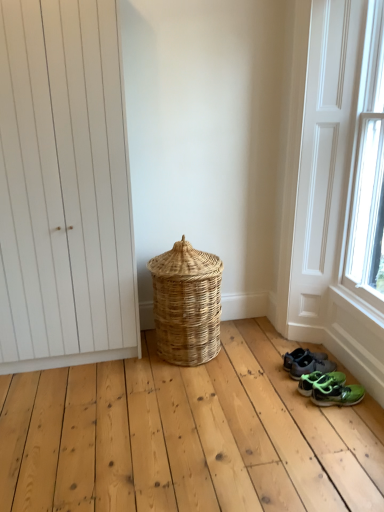
Question: From a real-world perspective, is green matte sneakers at lower right, marked as the third footwear in a back-to-front arrangement, below white wood screen door at lower right?

Choices:
 (A) no
 (B) yes

Answer: (B)

Question: From a real-world perspective, is green matte sneakers at lower right, marked as the third footwear in a back-to-front arrangement, on top of white wood screen door at lower right?

Choices:
 (A) no
 (B) yes

Answer: (A)

Question: Can you confirm if green matte sneakers at lower right, marked as the third footwear in a back-to-front arrangement, is thinner than white wood screen door at lower right?

Choices:
 (A) yes
 (B) no

Answer: (B)

Question: From the image's perspective, is green matte sneakers at lower right, which appears as the 1th footwear when viewed from the front, below white wood screen door at lower right?

Choices:
 (A) yes
 (B) no

Answer: (A)

Question: Does green matte sneakers at lower right, marked as the third footwear in a back-to-front arrangement, come in front of white wood screen door at lower right?

Choices:
 (A) no
 (B) yes

Answer: (A)

Question: From a real-world perspective, is green fabric sneakers at lower right, which ranks as the 1th footwear in back-to-front order, above or below white wood screen door at lower right?

Choices:
 (A) above
 (B) below

Answer: (B)

Question: Visually, is green fabric sneakers at lower right, placed as the third footwear when sorted from front to back, positioned to the left or to the right of white wood screen door at lower right?

Choices:
 (A) left
 (B) right

Answer: (A)

Question: Is green fabric sneakers at lower right, which ranks as the 1th footwear in back-to-front order, wider or thinner than white wood screen door at lower right?

Choices:
 (A) thin
 (B) wide

Answer: (B)

Question: In the image, is green fabric sneakers at lower right, placed as the third footwear when sorted from front to back, positioned in front of or behind white wood screen door at lower right?

Choices:
 (A) front
 (B) behind

Answer: (B)

Question: Relative to green matte sneakers at lower right, which appears as the 1th footwear when viewed from the front, is green rubber sandals at lower right, the second footwear from the front, in front or behind?

Choices:
 (A) front
 (B) behind

Answer: (B)

Question: Is point (312, 356) closer or farther from the camera than point (329, 387)?

Choices:
 (A) closer
 (B) farther

Answer: (B)

Question: From a real-world perspective, relative to green matte sneakers at lower right, which appears as the 1th footwear when viewed from the front, is green rubber sandals at lower right, arranged as the 2th footwear when viewed from the back, vertically above or below?

Choices:
 (A) below
 (B) above

Answer: (A)

Question: Is green rubber sandals at lower right, arranged as the 2th footwear when viewed from the back, to the left or to the right of green matte sneakers at lower right, which appears as the 1th footwear when viewed from the front, in the image?

Choices:
 (A) right
 (B) left

Answer: (B)

Question: Based on their sizes in the image, would you say green rubber sandals at lower right, arranged as the 2th footwear when viewed from the back, is bigger or smaller than green fabric sneakers at lower right, which ranks as the 1th footwear in back-to-front order?

Choices:
 (A) big
 (B) small

Answer: (B)

Question: Is green rubber sandals at lower right, the second footwear from the front, to the left or to the right of green fabric sneakers at lower right, placed as the third footwear when sorted from front to back, in the image?

Choices:
 (A) left
 (B) right

Answer: (B)